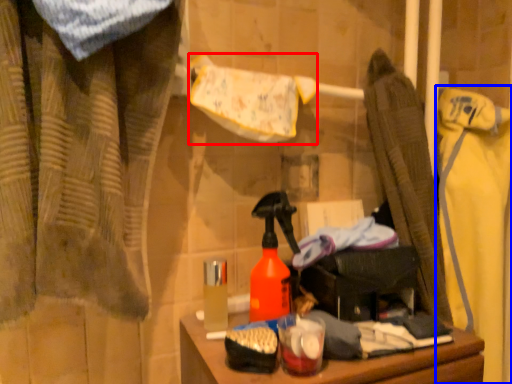
Question: Among these objects, which one is farthest to the camera, bath towel (highlighted by a red box) or clothing (highlighted by a blue box)?

Choices:
 (A) bath towel
 (B) clothing

Answer: (B)